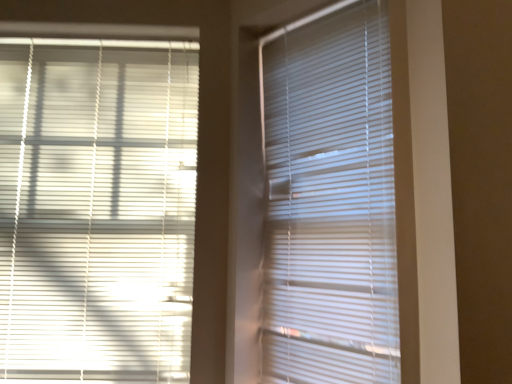
Question: Considering the relative sizes of white matte blinds at left, the 1th window blind viewed from the left, and white matte window blind at center, acting as the first window blind starting from the right, in the image provided, is white matte blinds at left, the 1th window blind viewed from the left, shorter than white matte window blind at center, acting as the first window blind starting from the right,?

Choices:
 (A) no
 (B) yes

Answer: (A)

Question: Is white matte blinds at left, the 2th window blind from the right, facing away from white matte window blind at center, acting as the first window blind starting from the right?

Choices:
 (A) yes
 (B) no

Answer: (B)

Question: From a real-world perspective, is white matte blinds at left, the 1th window blind viewed from the left, located higher than white matte window blind at center, which is counted as the second window blind, starting from the left?

Choices:
 (A) yes
 (B) no

Answer: (B)

Question: Is white matte blinds at left, the 2th window blind from the right, at the left side of white matte window blind at center, acting as the first window blind starting from the right?

Choices:
 (A) no
 (B) yes

Answer: (B)

Question: Can you confirm if white matte blinds at left, the 1th window blind viewed from the left, is wider than white matte window blind at center, which is counted as the second window blind, starting from the left?

Choices:
 (A) no
 (B) yes

Answer: (B)

Question: Are white matte blinds at left, the 1th window blind viewed from the left, and white matte window blind at center, acting as the first window blind starting from the right, far apart?

Choices:
 (A) no
 (B) yes

Answer: (A)

Question: Can white matte blinds at left, the 2th window blind from the right, be found inside white matte window blind at center, acting as the first window blind starting from the right?

Choices:
 (A) yes
 (B) no

Answer: (B)

Question: Are white matte window blind at center, which is counted as the second window blind, starting from the left, and white matte blinds at left, the 2th window blind from the right, located far from each other?

Choices:
 (A) yes
 (B) no

Answer: (B)

Question: Is white matte window blind at center, acting as the first window blind starting from the right, at the left side of white matte blinds at left, the 1th window blind viewed from the left?

Choices:
 (A) no
 (B) yes

Answer: (A)

Question: Is white matte window blind at center, which is counted as the second window blind, starting from the left, closer to the viewer compared to white matte blinds at left, the 1th window blind viewed from the left?

Choices:
 (A) no
 (B) yes

Answer: (B)

Question: Can you confirm if white matte window blind at center, acting as the first window blind starting from the right, is smaller than white matte blinds at left, the 2th window blind from the right?

Choices:
 (A) yes
 (B) no

Answer: (A)

Question: Considering the relative sizes of white matte window blind at center, which is counted as the second window blind, starting from the left, and white matte blinds at left, the 1th window blind viewed from the left, in the image provided, is white matte window blind at center, which is counted as the second window blind, starting from the left, taller than white matte blinds at left, the 1th window blind viewed from the left,?

Choices:
 (A) no
 (B) yes

Answer: (A)

Question: Is point (20, 114) positioned closer to the camera than point (348, 258)?

Choices:
 (A) farther
 (B) closer

Answer: (A)